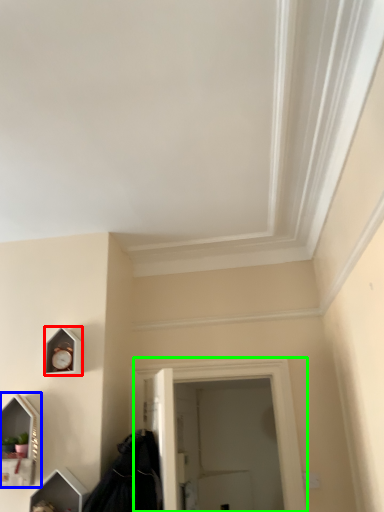
Question: Considering the real-world distances, which object is farthest from clock (highlighted by a red box)? medicine cabinet (highlighted by a blue box) or window (highlighted by a green box)?

Choices:
 (A) medicine cabinet
 (B) window

Answer: (B)